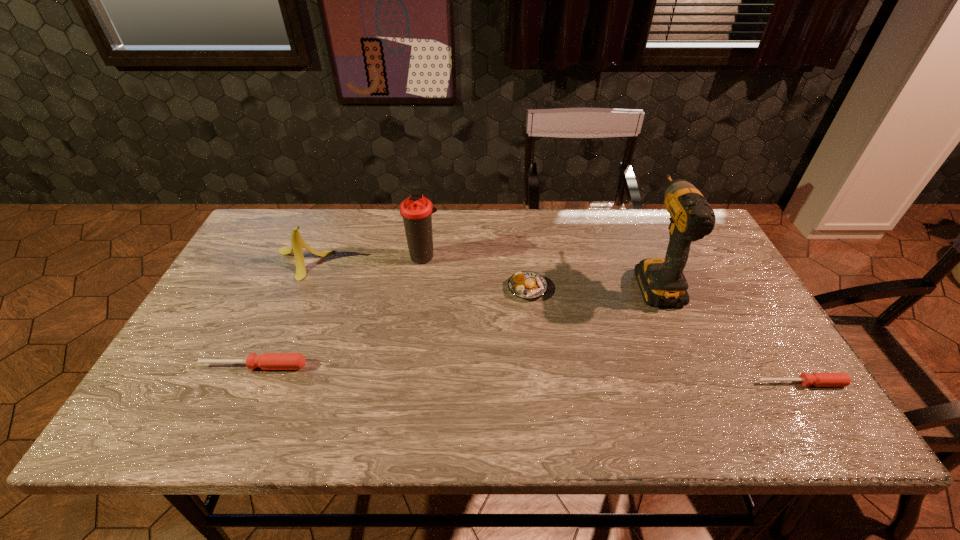
Where is `the second nearest object`? Image resolution: width=960 pixels, height=540 pixels. the second nearest object is located at coordinates (267, 361).

At what (x,y) coordinates should I click in order to perform the action: click on the left screwdriver. Please return your answer as a coordinate pair (x, y). The width and height of the screenshot is (960, 540). Looking at the image, I should click on (267, 361).

Find the location of a particular element. Image resolution: width=960 pixels, height=540 pixels. the nearer screwdriver is located at coordinates (817, 379).

Locate an element on the screen. This screenshot has height=540, width=960. the rightmost object is located at coordinates (817, 379).

At what (x,y) coordinates should I click in order to perform the action: click on the third object from left to right. Please return your answer as a coordinate pair (x, y). Looking at the image, I should click on [x=417, y=211].

The image size is (960, 540). In order to click on the fifth shortest object in this screenshot , I will do `click(417, 211)`.

The image size is (960, 540). I want to click on drill, so click(661, 280).

Where is `the second object from right to left`? the second object from right to left is located at coordinates (661, 280).

Locate an element on the screen. Image resolution: width=960 pixels, height=540 pixels. the third object from right to left is located at coordinates (529, 285).

Find the location of a particular element. banana is located at coordinates (298, 243).